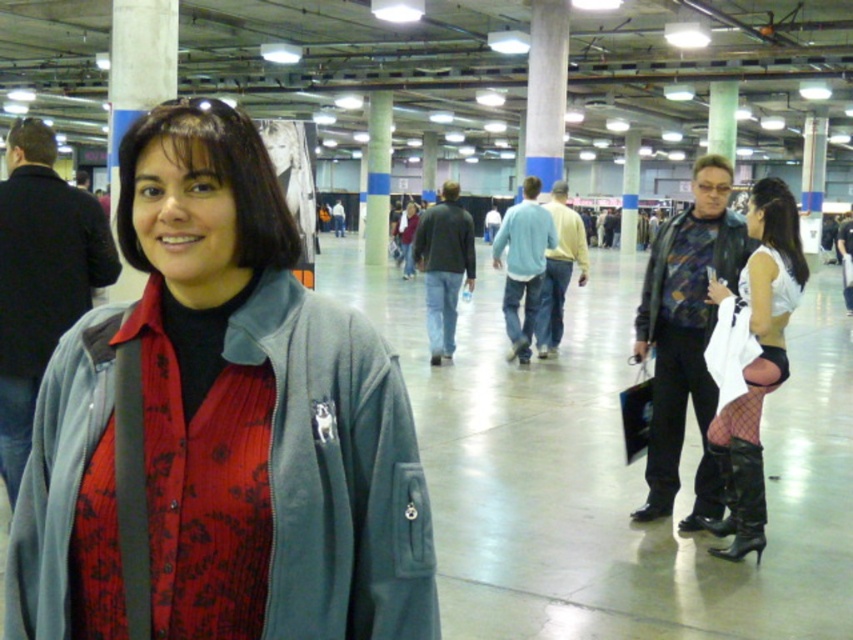
Question: Which point appears farthest from the camera in this image?

Choices:
 (A) (541, 237)
 (B) (77, 273)

Answer: (A)

Question: Is white mesh stockings at right smaller than dark gray jacket at center?

Choices:
 (A) yes
 (B) no

Answer: (B)

Question: Among these objects, which one is farthest from the camera?

Choices:
 (A) black leather boot at lower right
 (B) printed fabric jacket at right
 (C) matte gray jacket at center

Answer: (B)

Question: In this image, where is matte gray jacket at left located relative to light blue fleece jacket at center?

Choices:
 (A) above
 (B) below

Answer: (B)

Question: Can you confirm if printed fabric jacket at right is positioned to the left of light blue fleece jacket at center?

Choices:
 (A) yes
 (B) no

Answer: (B)

Question: Which point is closer to the camera?

Choices:
 (A) (761, 516)
 (B) (421, 234)
 (C) (512, 227)

Answer: (A)